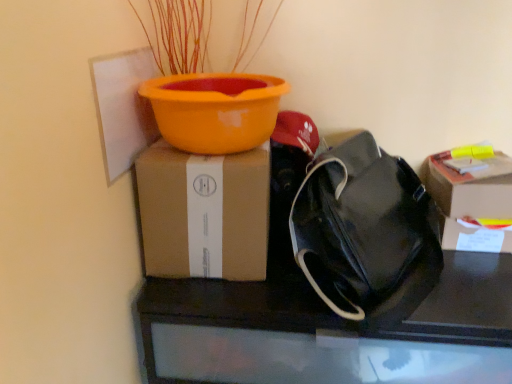
Question: Is cardboard box at right, arranged as the second box when viewed from the left, outside black leather bag at center?

Choices:
 (A) yes
 (B) no

Answer: (A)

Question: Does cardboard box at right, arranged as the second box when viewed from the left, lie behind black leather bag at center?

Choices:
 (A) yes
 (B) no

Answer: (A)

Question: Is there a large distance between cardboard box at right, which appears as the 1th box when viewed from the right, and black leather bag at center?

Choices:
 (A) no
 (B) yes

Answer: (A)

Question: Is cardboard box at right, arranged as the second box when viewed from the left, wider than black leather bag at center?

Choices:
 (A) no
 (B) yes

Answer: (A)

Question: Is cardboard box at right, which appears as the 1th box when viewed from the right, turned away from black leather bag at center?

Choices:
 (A) no
 (B) yes

Answer: (A)

Question: Is black leather bag at center inside or outside of brown cardboard box at upper left, which is counted as the 1th box, starting from the left?

Choices:
 (A) outside
 (B) inside

Answer: (A)

Question: From a real-world perspective, is black leather bag at center physically located above or below brown cardboard box at upper left, which is counted as the 1th box, starting from the left?

Choices:
 (A) below
 (B) above

Answer: (A)

Question: Considering their positions, is black leather bag at center located in front of or behind brown cardboard box at upper left, positioned as the second box in right-to-left order?

Choices:
 (A) front
 (B) behind

Answer: (A)

Question: Is black leather bag at center wider or thinner than brown cardboard box at upper left, which is counted as the 1th box, starting from the left?

Choices:
 (A) wide
 (B) thin

Answer: (A)

Question: From a real-world perspective, relative to cardboard box at right, which appears as the 1th box when viewed from the right, is black leather handbag at right vertically above or below?

Choices:
 (A) below
 (B) above

Answer: (B)

Question: Based on their positions, is black leather handbag at right located to the left or right of cardboard box at right, which appears as the 1th box when viewed from the right?

Choices:
 (A) right
 (B) left

Answer: (B)

Question: Looking at their shapes, would you say black leather handbag at right is wider or thinner than cardboard box at right, arranged as the second box when viewed from the left?

Choices:
 (A) thin
 (B) wide

Answer: (B)

Question: Considering the positions of black leather handbag at right and cardboard box at right, which appears as the 1th box when viewed from the right, in the image, is black leather handbag at right taller or shorter than cardboard box at right, which appears as the 1th box when viewed from the right,?

Choices:
 (A) short
 (B) tall

Answer: (B)

Question: From a real-world perspective, is black leather bag at center positioned above or below black leather handbag at right?

Choices:
 (A) above
 (B) below

Answer: (B)

Question: In the image, is black leather bag at center on the left side or the right side of black leather handbag at right?

Choices:
 (A) left
 (B) right

Answer: (B)